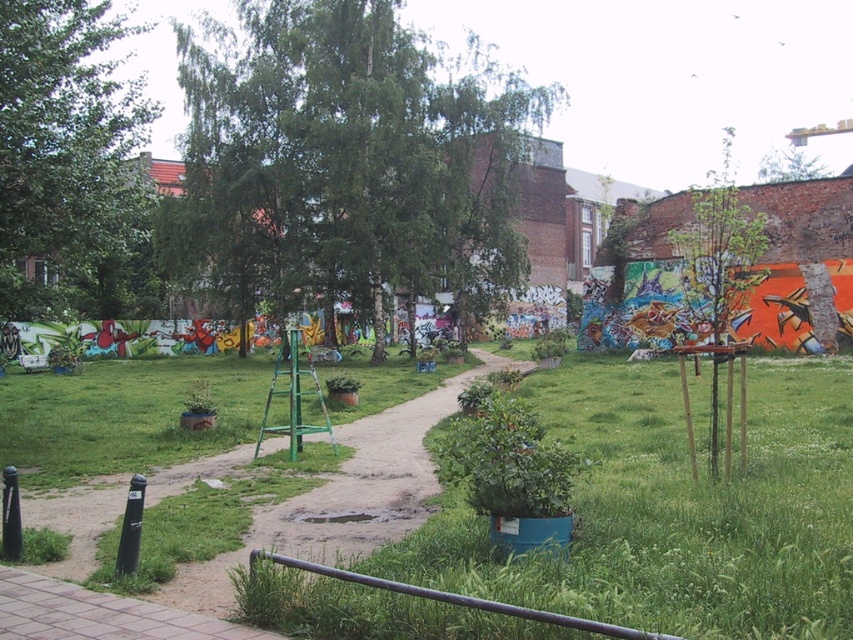
Question: Among these points, which one is nearest to the camera?

Choices:
 (A) (80, 296)
 (B) (798, 148)
 (C) (305, 266)

Answer: (C)

Question: Does green leafy tree at center appear on the left side of green leafy tree at upper left?

Choices:
 (A) yes
 (B) no

Answer: (B)

Question: Which of the following is the farthest from the observer?

Choices:
 (A) green leafy tree at upper left
 (B) green leafy tree at upper right

Answer: (B)

Question: Which object is closer to the camera taking this photo?

Choices:
 (A) green leafy tree at center
 (B) green leafy tree at upper right

Answer: (A)

Question: Does green leafy tree at center have a lesser width compared to green leafy tree at upper right?

Choices:
 (A) yes
 (B) no

Answer: (A)

Question: From the image, what is the correct spatial relationship of green leafy tree at center in relation to green leafy tree at upper right?

Choices:
 (A) above
 (B) below

Answer: (B)